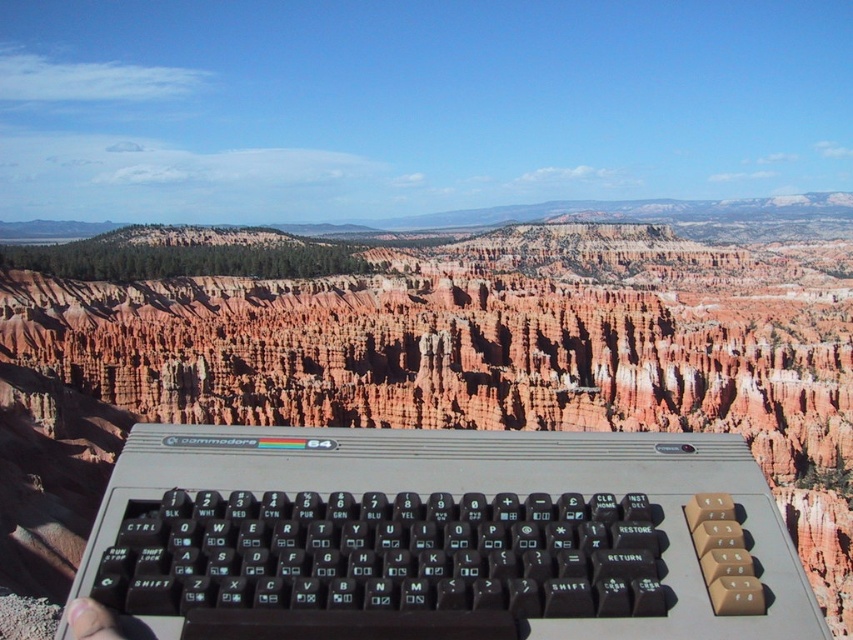
You are a photographer trying to capture both the gray plastic keyboard at center and the skinny flesh at lower left in your shot. Which object appears larger in the frame?

The gray plastic keyboard at center appears much larger in the frame than the skinny flesh at lower left because it is taller.

You are a photographer trying to capture the gray plastic keyboard at center and the skinny flesh at lower left in the same frame. Based on their positions, which object should you adjust your camera to focus on first to ensure both are in the shot?

You should focus on the gray plastic keyboard at center first because it is positioned to the right of the skinny flesh at lower left, meaning it is farther away from the camera. By focusing on the farther object first, you can ensure both are within the camera frame.